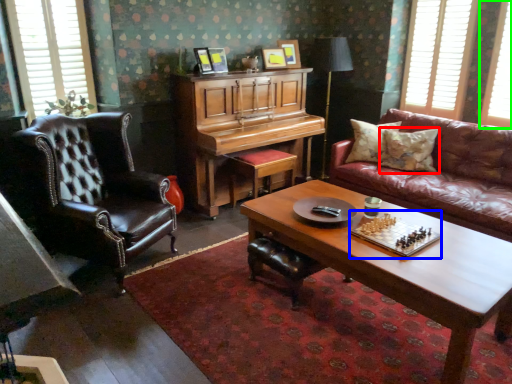
Question: Considering the real-world distances, which object is farthest from pillow (highlighted by a red box)? board game (highlighted by a blue box) or window (highlighted by a green box)?

Choices:
 (A) board game
 (B) window

Answer: (A)